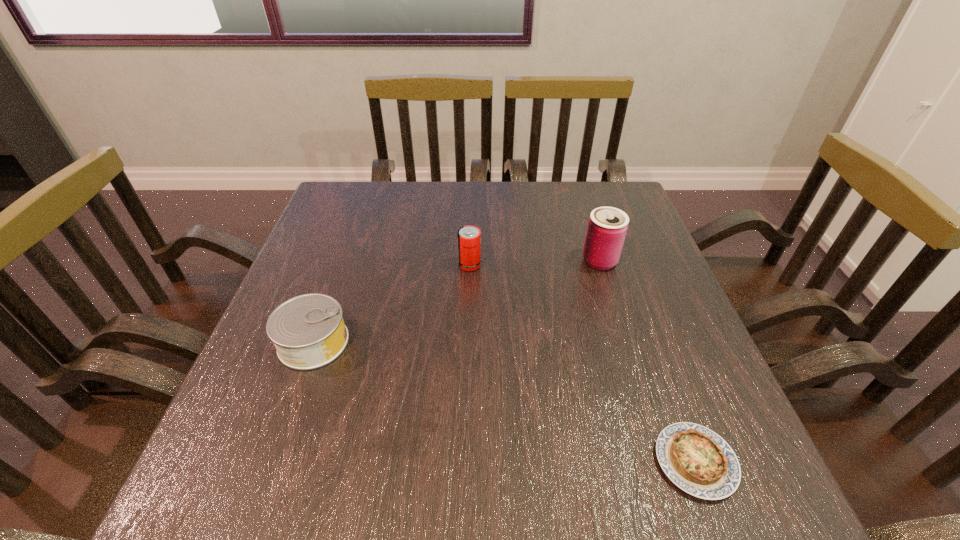
Where is `free point between the second tallest can and the second nearest object`? free point between the second tallest can and the second nearest object is located at coordinates (392, 303).

At what (x,y) coordinates should I click in order to perform the action: click on empty location between the quiche and the tallest can. Please return your answer as a coordinate pair (x, y). This screenshot has height=540, width=960. Looking at the image, I should click on (648, 361).

Locate an element on the screen. object that is the closest to the second tallest can is located at coordinates (607, 227).

Point out which object is positioned as the nearest to the leftmost object. Please provide its 2D coordinates. Your answer should be formatted as a tuple, i.e. [(x, y)], where the tuple contains the x and y coordinates of a point satisfying the conditions above.

[(469, 237)]

Choose which can is the nearest neighbor to the third object from right to left. Please provide its 2D coordinates. Your answer should be formatted as a tuple, i.e. [(x, y)], where the tuple contains the x and y coordinates of a point satisfying the conditions above.

[(607, 227)]

Locate which can is the closest to the leftmost can. Please provide its 2D coordinates. Your answer should be formatted as a tuple, i.e. [(x, y)], where the tuple contains the x and y coordinates of a point satisfying the conditions above.

[(469, 237)]

Where is `free spot that satisfies the following two spatial constraints: 1. on the front side of the shortest can; 2. on the left side of the quiche`? free spot that satisfies the following two spatial constraints: 1. on the front side of the shortest can; 2. on the left side of the quiche is located at coordinates (271, 462).

Where is `vacant space that satisfies the following two spatial constraints: 1. on the front side of the tallest can; 2. on the left side of the shortest object`? vacant space that satisfies the following two spatial constraints: 1. on the front side of the tallest can; 2. on the left side of the shortest object is located at coordinates (662, 462).

Identify the location of free space that satisfies the following two spatial constraints: 1. on the front side of the second nearest object; 2. on the right side of the quiche. (271, 462).

The image size is (960, 540). In order to click on vacant position in the image that satisfies the following two spatial constraints: 1. on the front side of the second can from right to left; 2. on the left side of the quiche in this screenshot , I will do [x=465, y=462].